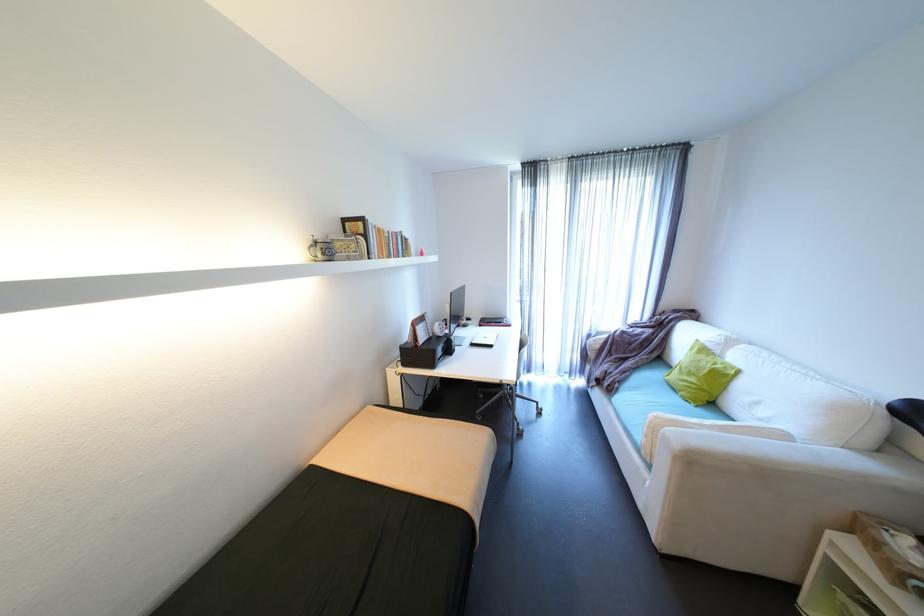
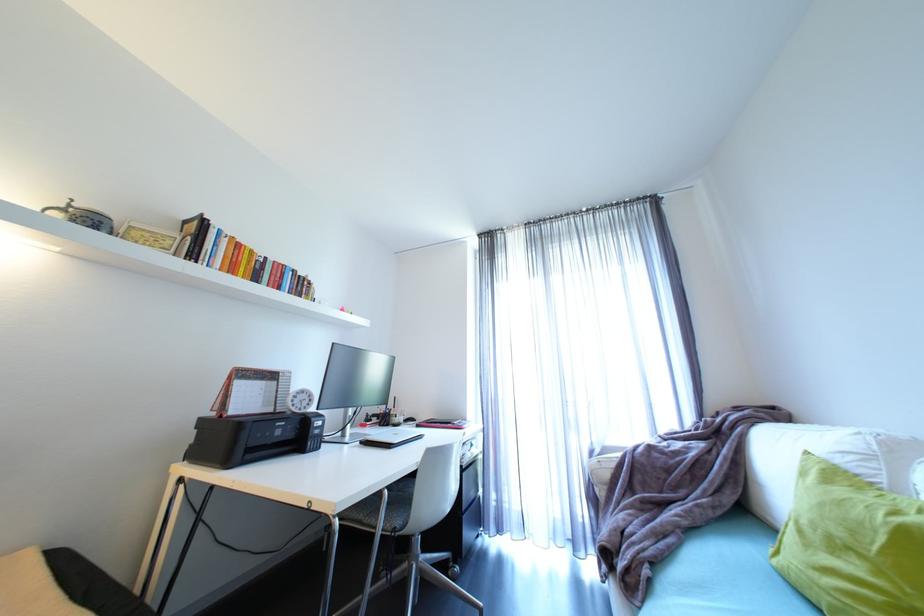
In the second image, find the point that corresponds to [380,254] in the first image.

(208, 262)